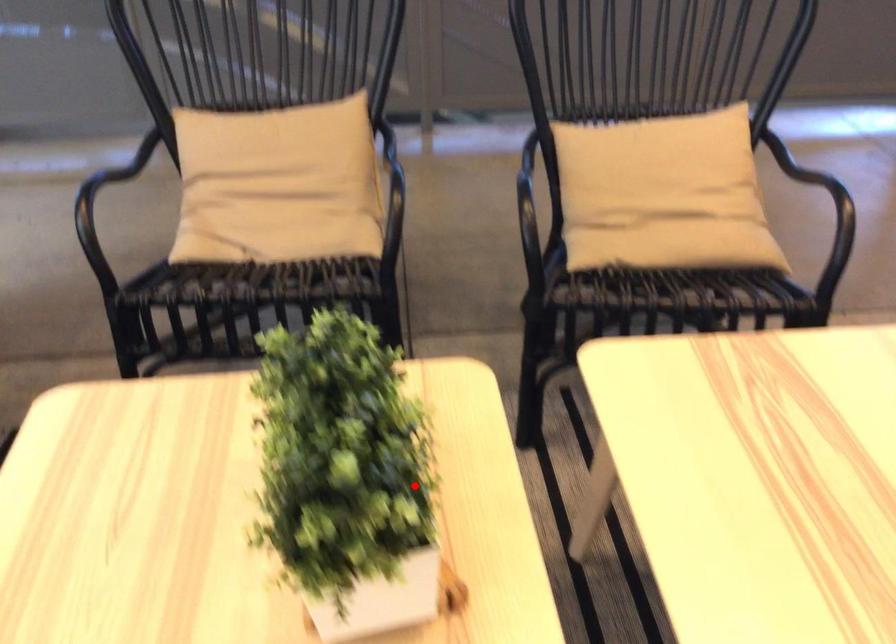
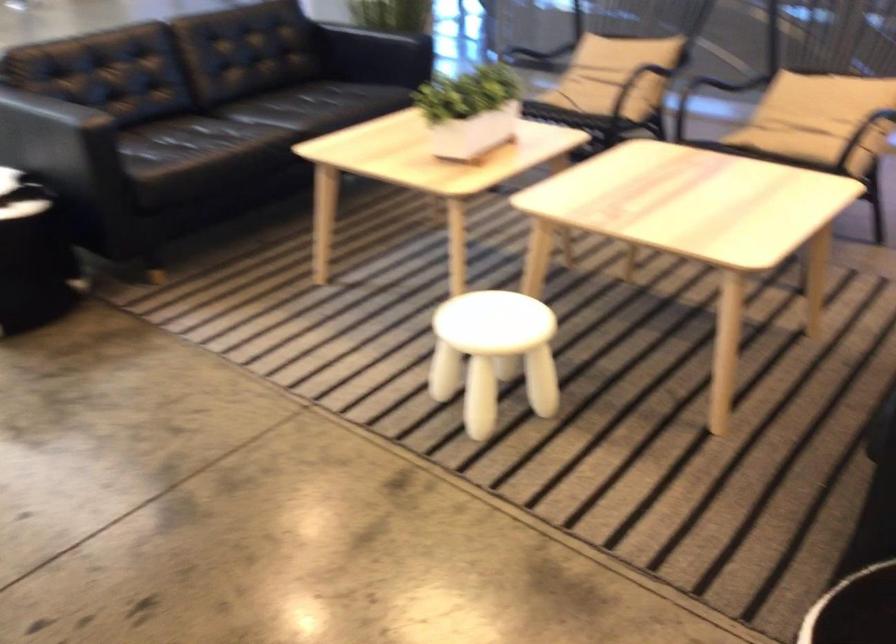
Question: I am providing you with two images of the same scene from different viewpoints. Given a red point in image1, look at the same physical point in image2. Is it:

Choices:
 (A) Closer to the viewpoint
 (B) Farther from the viewpoint

Answer: (B)